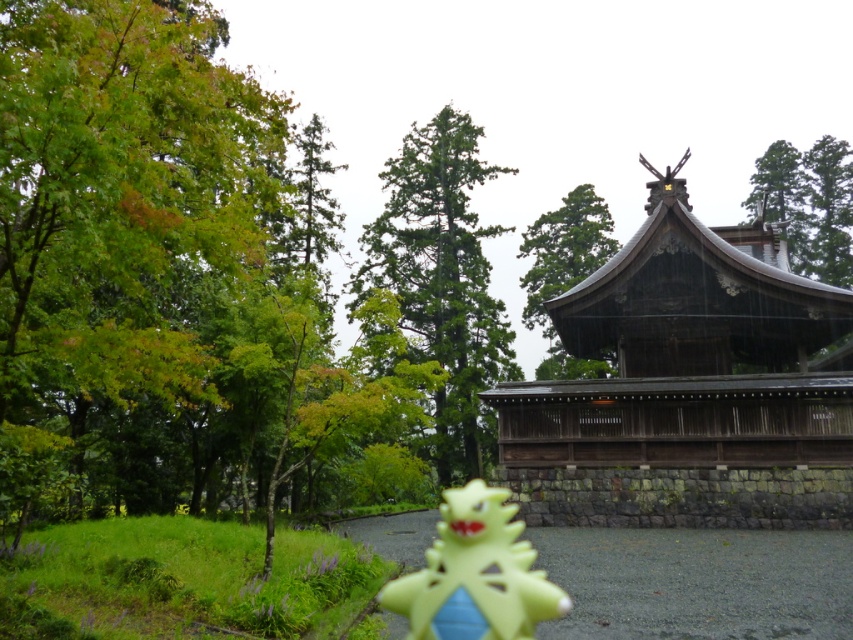
Is point (537, 604) in front of point (532, 310)?

Yes, point (537, 604) is in front of point (532, 310).

Is yellow plastic toy at center wider than green wood tree at upper center?

No, yellow plastic toy at center is not wider than green wood tree at upper center.

Between point (451, 577) and point (546, 248), which one is positioned in front?

Point (451, 577)

Locate an element on the screen. This screenshot has width=853, height=640. yellow plastic toy at center is located at coordinates (474, 573).

Between point (537, 257) and point (788, 144), which one is positioned behind?

The point (788, 144) is more distant.

Is green wood tree at upper center smaller than green textured tree at upper center?

Actually, green wood tree at upper center might be larger than green textured tree at upper center.

Between point (544, 282) and point (780, 144), which one is positioned behind?

The point (780, 144) is behind.

Find the location of a particular element. This screenshot has width=853, height=640. green wood tree at upper center is located at coordinates (564, 272).

Does green leafy tree at left have a greater width compared to yellow plastic toy at center?

Yes, green leafy tree at left is wider than yellow plastic toy at center.

Is green leafy tree at left smaller than yellow plastic toy at center?

Incorrect, green leafy tree at left is not smaller in size than yellow plastic toy at center.

Is point (219, 192) closer to camera compared to point (480, 483)?

No, (219, 192) is further to viewer.

This screenshot has height=640, width=853. Identify the location of green leafy tree at left. (119, 241).